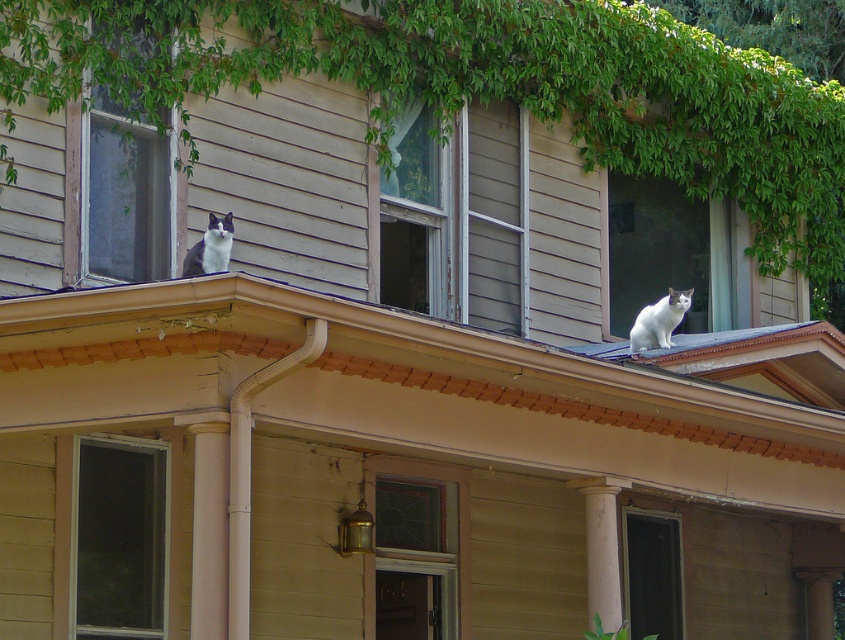
Question: Can you confirm if transparent glass window at upper right is smaller than white smooth column at center?

Choices:
 (A) no
 (B) yes

Answer: (A)

Question: Which object is the closest to the transparent glass window at upper right?

Choices:
 (A) white fur cat at upper right
 (B) white marble column at center

Answer: (A)

Question: From the image, what is the correct spatial relationship of transparent glass door at lower left in relation to clear glass door at center?

Choices:
 (A) below
 (B) above

Answer: (B)

Question: Estimate the real-world distances between objects in this image. Which object is farther from the transparent glass window at upper right?

Choices:
 (A) wooden window at center
 (B) clear glass door at center
 (C) beige wood porch at upper center

Answer: (A)

Question: Is beige wood porch at upper center thinner than clear glass window at upper left?

Choices:
 (A) no
 (B) yes

Answer: (A)

Question: Among these points, which one is nearest to the camera?

Choices:
 (A) (431, 557)
 (B) (104, 595)
 (C) (592, 561)

Answer: (B)